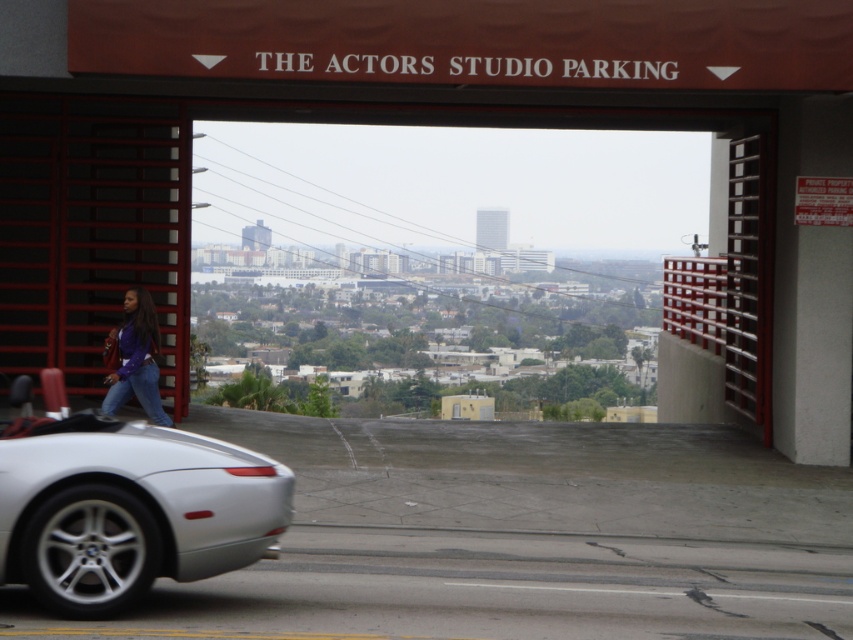
You are a photographer trying to capture a photo of the silver metallic car at lower left and the matte purple shirt at center. Since you want to emphasize the car, which object should you place closer to the camera lens?

To emphasize the silver metallic car at lower left, you should place it closer to the camera lens. Even though the matte purple shirt at center appears larger in the scene, positioning the car closer will make it appear bigger in the photo, drawing more attention to it.

You are a delivery person trying to find the entrance to The Actors Studio Parking. You see a silver metallic car at lower left and a matte purple shirt at center. Which object is closer to the entrance?

The silver metallic car at lower left is positioned on the right side of matte purple shirt at center, so the matte purple shirt at center is closer to the entrance since it is positioned to the left of the car.